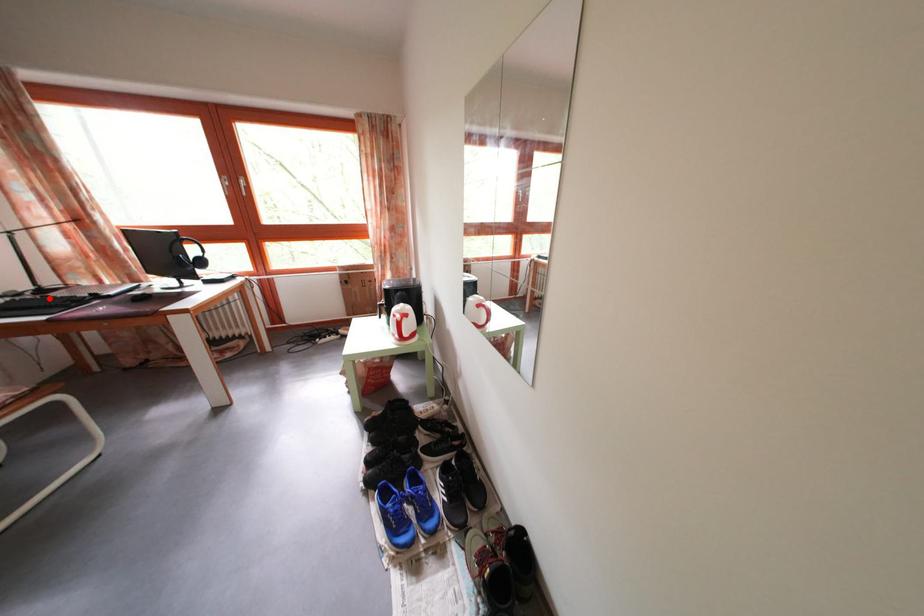
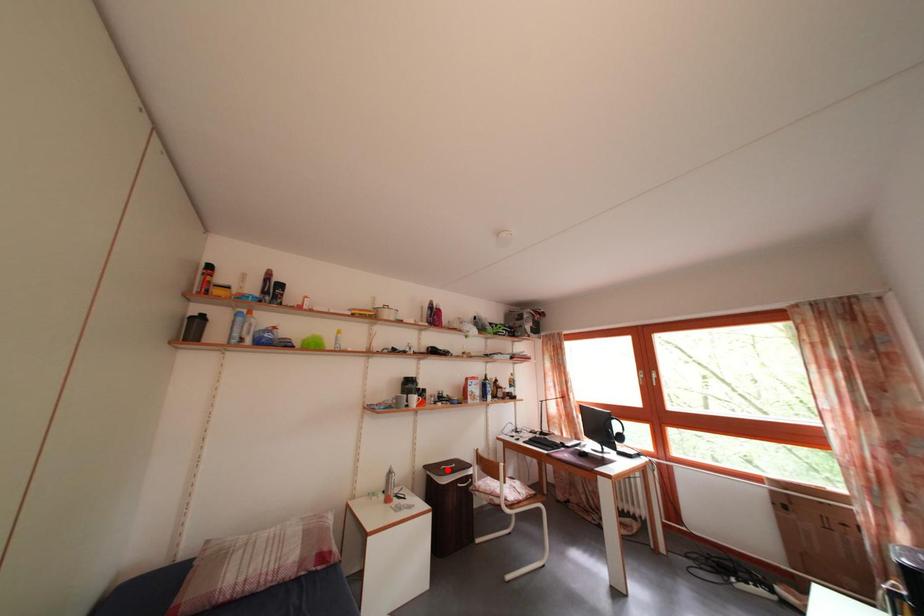
I am providing you with two images of the same scene from different viewpoints. A red point is marked on the first image and another point is marked on the second image. Do the highlighted points in image1 and image2 indicate the same real-world spot?

No